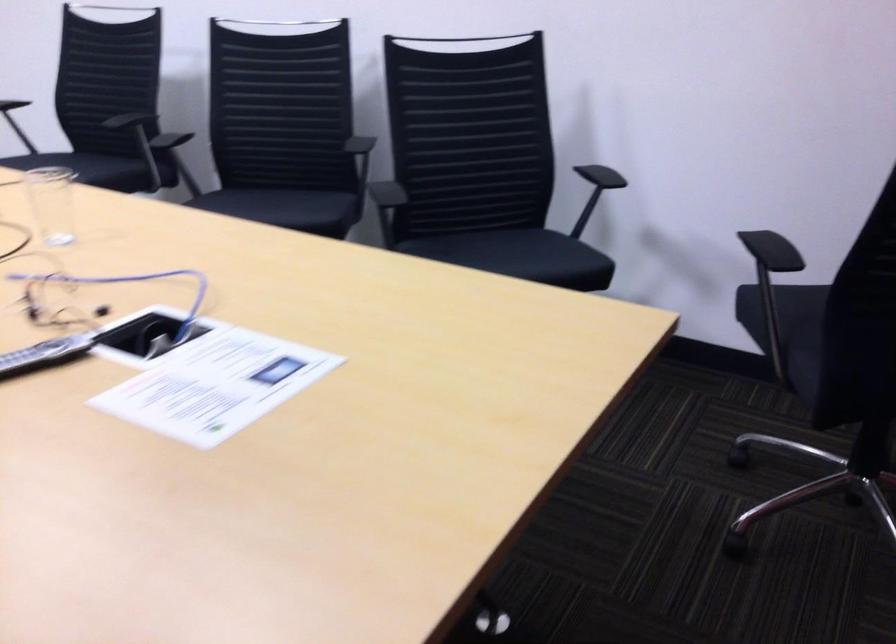
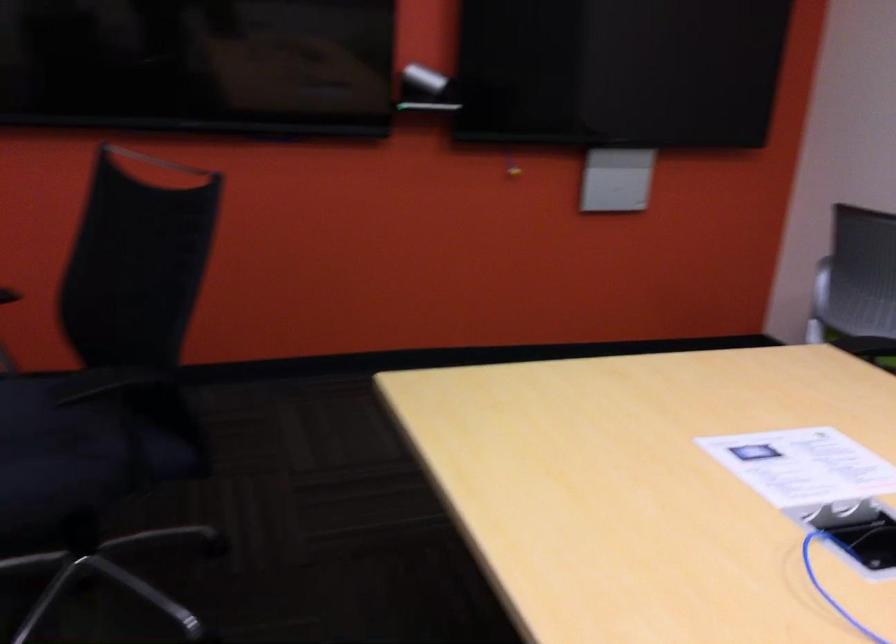
Where in the second image is the point corresponding to (x=144, y=374) from the first image?

(858, 532)